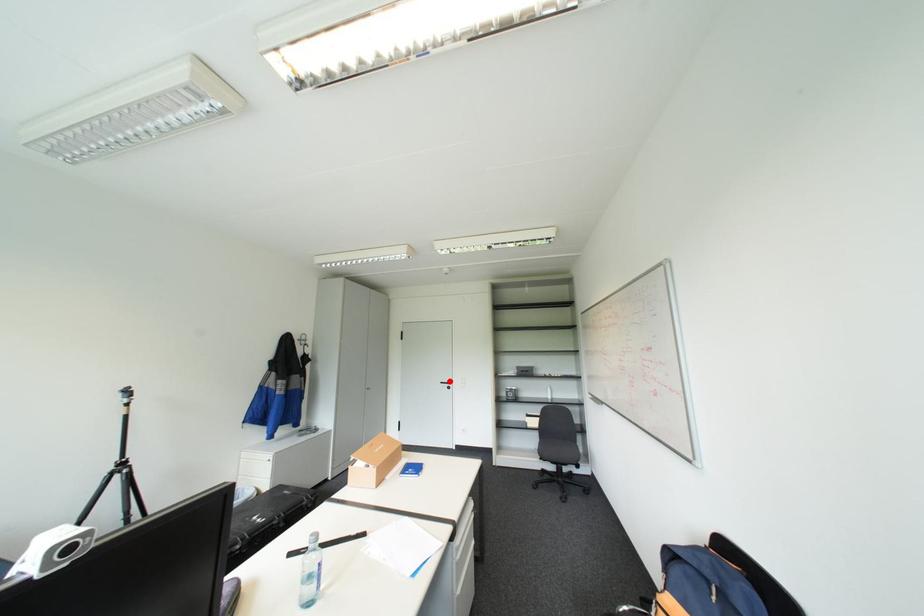
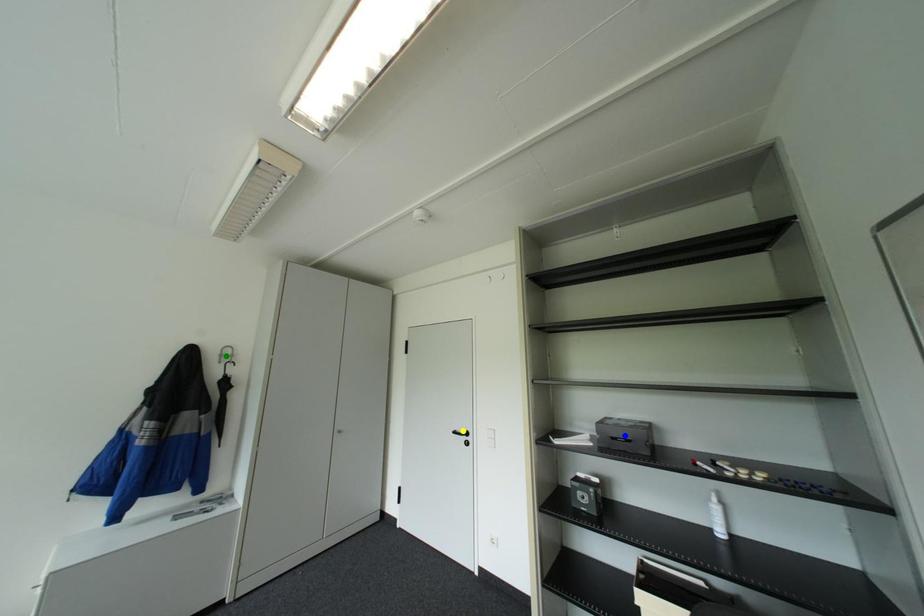
Question: I am providing you with two images of the same scene from different viewpoints. A red point is marked on the first image. You are given multiple points on the second image. Which point in image 2 represents the same 3d spot as the red point in image 1?

Choices:
 (A) yellow point
 (B) blue point
 (C) green point

Answer: (A)